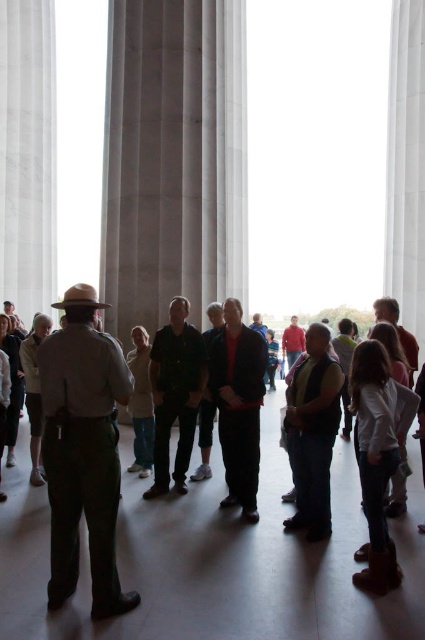
You are standing in the large hall with the khaki uniform at center and the red fabric jacket at center. Which one is nearer to you?

The khaki uniform at center is closer to the viewer than the red fabric jacket at center.

You are standing in the large hall and want to move from point A to point B. Point A is at coordinate point (399, 205) and point B is at coordinate point (187, 356). Which point is closer to you when you first enter the hall?

Point B at coordinate point (187, 356) is closer to you when you first enter the hall because point A at coordinate point (399, 205) is further to the camera than point B.

You are an interior designer planning to place a 2m wide decorative panel between the khaki uniform at center and the red fabric jacket at center. Given their widths, will the panel fit without overlapping either?

The khaki uniform at center is narrower than the red fabric jacket at center. Since the panel is 2m wide, it depends on the combined space between them. However, without knowing the exact distance between the two, we cannot confirm if the panel will fit. Please provide more information about their positioning.